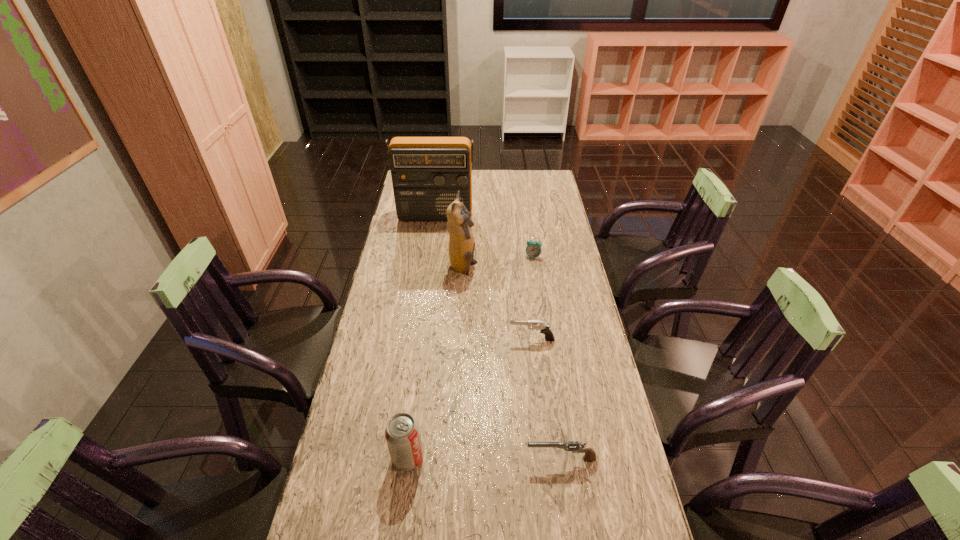
Find the location of a particular element. free spot at the right edge of the desktop is located at coordinates (556, 245).

In order to click on vacant space at the far right corner of the desktop in this screenshot , I will do `click(532, 176)`.

Where is `free space between the alarm clock and the shorter gun`? The image size is (960, 540). free space between the alarm clock and the shorter gun is located at coordinates pos(547,357).

Identify the location of vacant space that's between the radio receiver and the nearer gun. (498, 338).

The height and width of the screenshot is (540, 960). Find the location of `empty location between the soda can and the fifth nearest object`. empty location between the soda can and the fifth nearest object is located at coordinates (470, 357).

Identify the location of vacant space that is in between the farthest object and the third nearest object. (483, 278).

At what (x,y) coordinates should I click in order to perform the action: click on vacant space in between the third tallest object and the cat. Please return your answer as a coordinate pair (x, y). This screenshot has height=540, width=960. Looking at the image, I should click on (436, 363).

Locate an element on the screen. The width and height of the screenshot is (960, 540). blank region between the farther gun and the farthest object is located at coordinates (483, 278).

Locate an element on the screen. vacant area that lies between the second farthest object and the farther gun is located at coordinates (532, 298).

What are the coordinates of `free space between the fifth nearest object and the farthest object` in the screenshot? It's located at (484, 237).